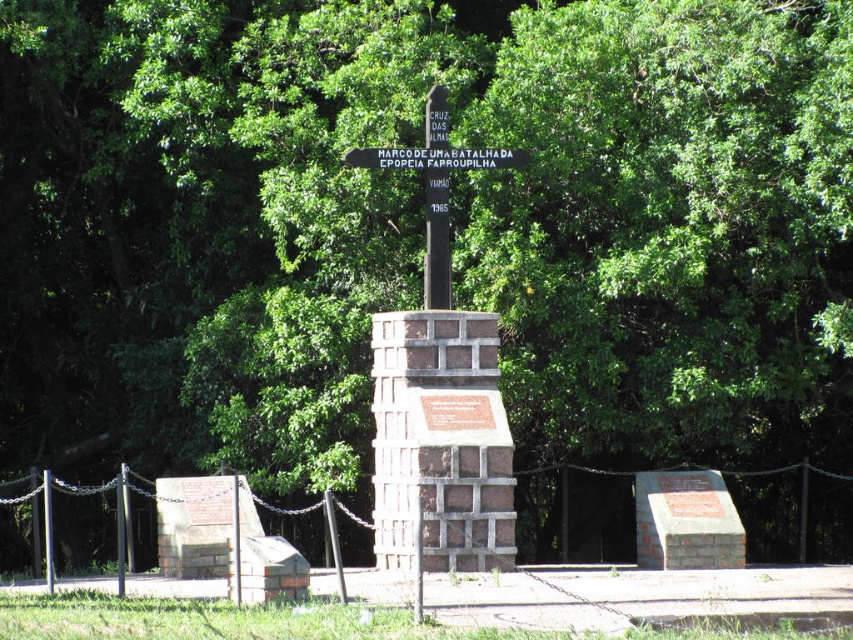
Who is positioned more to the right, black polished wood signpost at center or white plastic sign at center?

white plastic sign at center is more to the right.

Between black polished wood signpost at center and white plastic sign at center, which one appears on the left side from the viewer's perspective?

black polished wood signpost at center is more to the left.

Is point (514, 148) more distant than point (474, 163)?

That is False.

Locate an element on the screen. The image size is (853, 640). black polished wood signpost at center is located at coordinates (434, 186).

From the picture: Does brown brick monument at center have a larger size compared to black polished wood signpost at center?

Correct, brown brick monument at center is larger in size than black polished wood signpost at center.

Is brown brick monument at center to the right of black polished wood signpost at center from the viewer's perspective?

Correct, you'll find brown brick monument at center to the right of black polished wood signpost at center.

The image size is (853, 640). Find the location of `brown brick monument at center`. brown brick monument at center is located at coordinates (438, 388).

What are the coordinates of `brown brick monument at center` in the screenshot? It's located at (438, 388).

Can you confirm if brown brick monument at center is bigger than white plastic sign at center?

Correct, brown brick monument at center is larger in size than white plastic sign at center.

Does point (440, 96) lie in front of point (393, 154)?

No.

I want to click on brown brick monument at center, so click(438, 388).